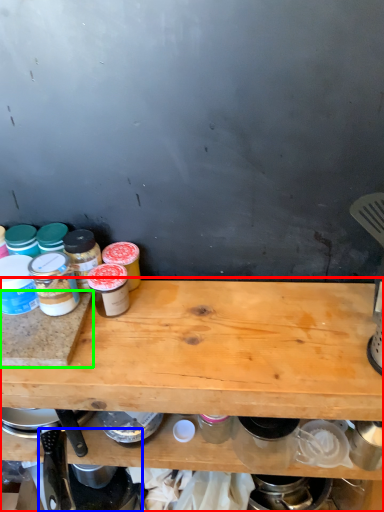
Question: Which is nearer to the table (highlighted by a red box)? appliance (highlighted by a blue box) or cutting board (highlighted by a green box).

Choices:
 (A) appliance
 (B) cutting board

Answer: (B)